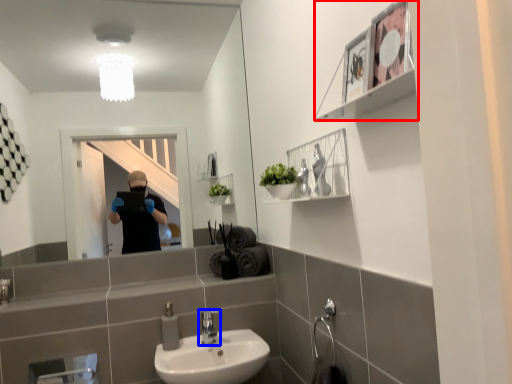
Question: Which object is closer to the camera taking this photo, cabinet (highlighted by a red box) or tap (highlighted by a blue box)?

Choices:
 (A) cabinet
 (B) tap

Answer: (A)